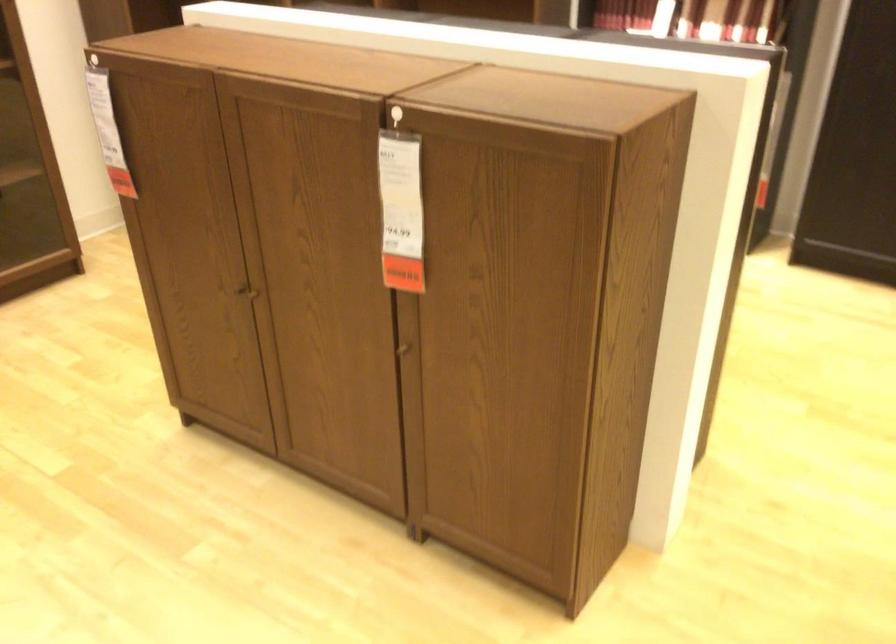
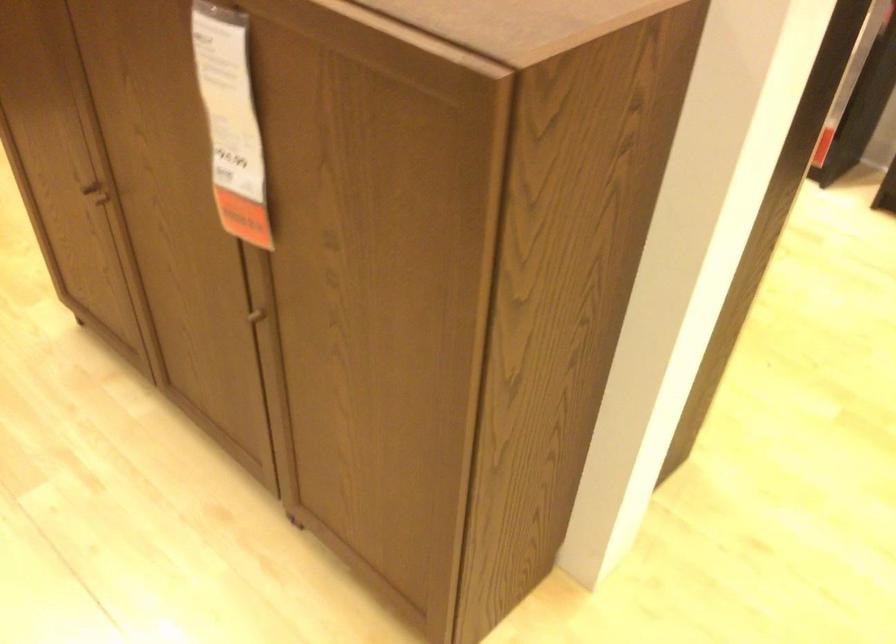
Where in the second image is the point corresponding to point 398,205 from the first image?

(230, 122)